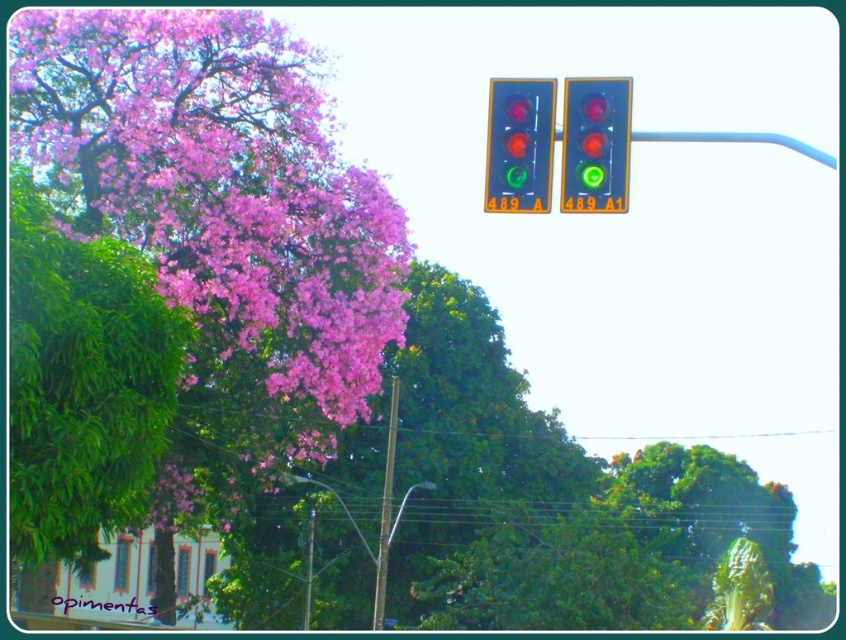
Who is lower down, pink matte flower at upper left or metallic pole at center?

metallic pole at center is lower down.

Can you confirm if pink matte flower at upper left is wider than metallic pole at center?

Yes, pink matte flower at upper left is wider than metallic pole at center.

The width and height of the screenshot is (846, 640). In order to click on pink matte flower at upper left in this screenshot , I will do `click(221, 220)`.

Does matte glass traffic light at upper right have a greater height compared to metallic pole at center?

Incorrect, matte glass traffic light at upper right's height is not larger of metallic pole at center's.

Who is taller, matte glass traffic light at upper right or metallic pole at center?

metallic pole at center is taller.

Where is `matte glass traffic light at upper right`? matte glass traffic light at upper right is located at coordinates (595, 145).

Does matte black traffic light at upper center appear over metallic pole at lower center?

Yes.

Between matte black traffic light at upper center and metallic pole at lower center, which one is positioned higher?

matte black traffic light at upper center is above.

This screenshot has width=846, height=640. Describe the element at coordinates (519, 145) in the screenshot. I see `matte black traffic light at upper center` at that location.

At what (x,y) coordinates should I click in order to perform the action: click on matte black traffic light at upper center. Please return your answer as a coordinate pair (x, y). Looking at the image, I should click on (519, 145).